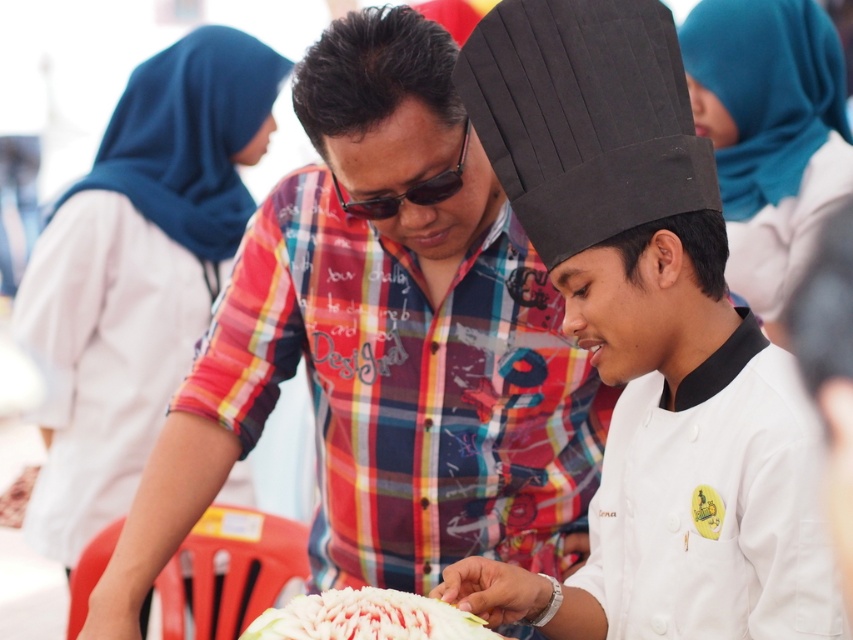
Question: Considering the relative positions of white chef hat at center and white fluffy cake at center in the image provided, where is white chef hat at center located with respect to white fluffy cake at center?

Choices:
 (A) left
 (B) right

Answer: (B)

Question: Which is farther from the white chef hat at center?

Choices:
 (A) white fluffy cake at center
 (B) blue fabric headscarf at upper center

Answer: (B)

Question: In this image, where is blue fabric headscarf at upper left located relative to white fluffy cake at center?

Choices:
 (A) above
 (B) below

Answer: (A)

Question: Which of the following is the farthest from the observer?

Choices:
 (A) (698, 109)
 (B) (639, 49)
 (C) (326, 74)
 (D) (351, 621)

Answer: (A)

Question: Which of the following is the closest to the observer?

Choices:
 (A) blue fabric headscarf at upper left
 (B) white chef hat at center
 (C) white fluffy cake at center

Answer: (B)

Question: Is plaid shirt at center to the right of blue fabric headscarf at upper left from the viewer's perspective?

Choices:
 (A) no
 (B) yes

Answer: (B)